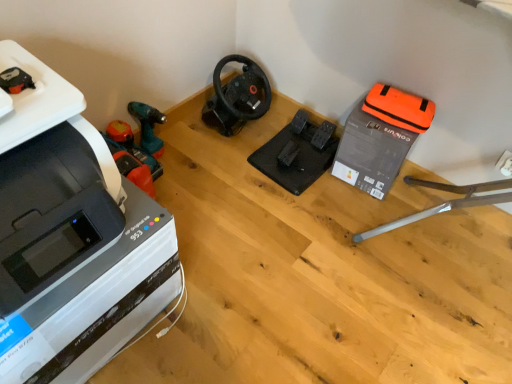
Identify the location of empty space that is to the right of white plastic printer at left. (234, 286).